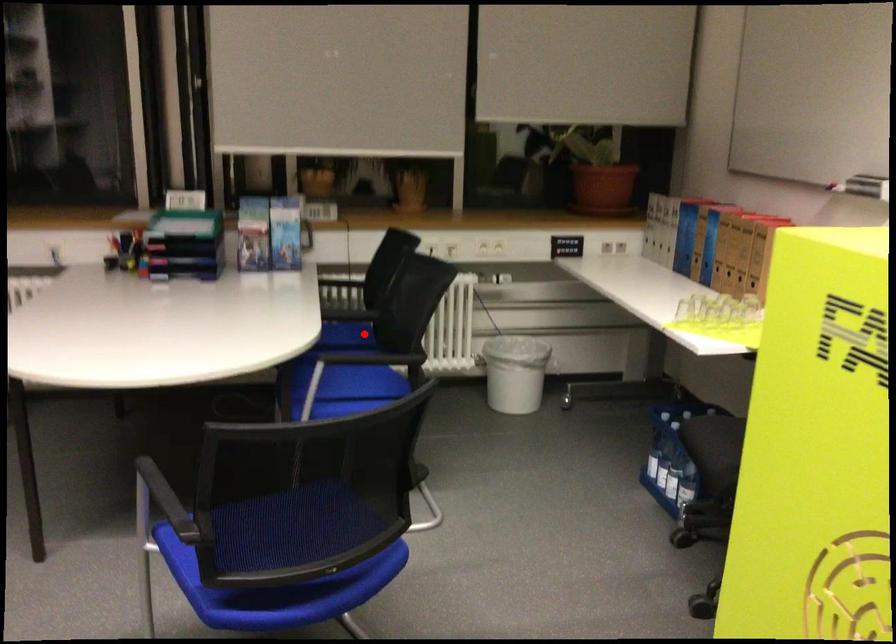
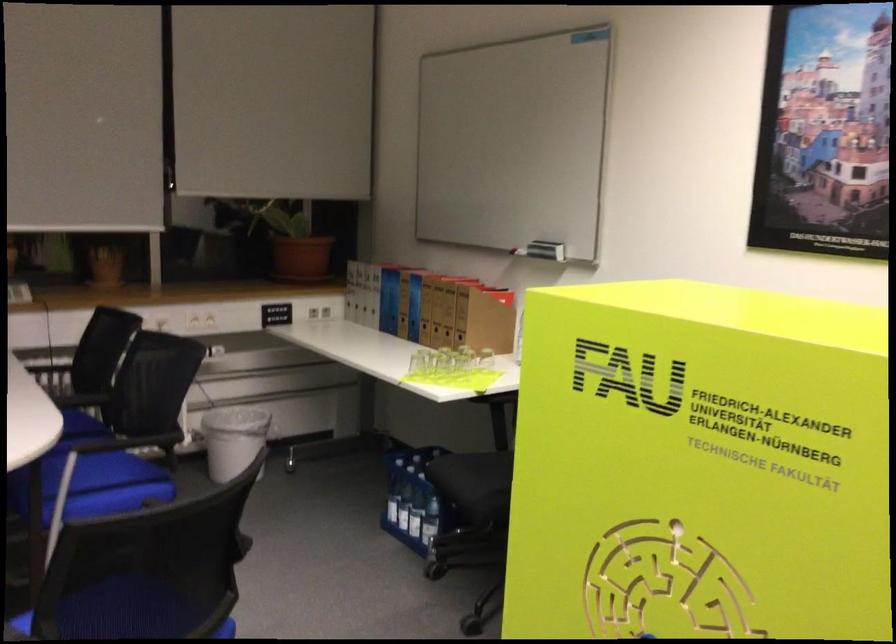
Where in the second image is the point corresponding to the highlighted location from the first image?

(81, 424)